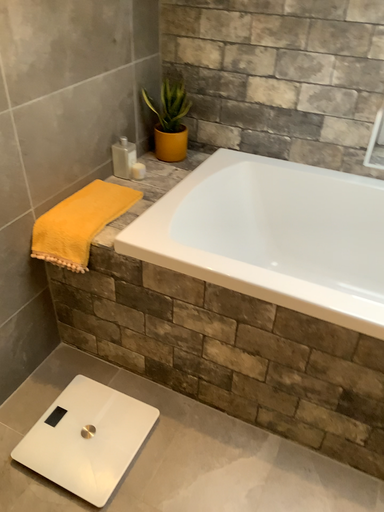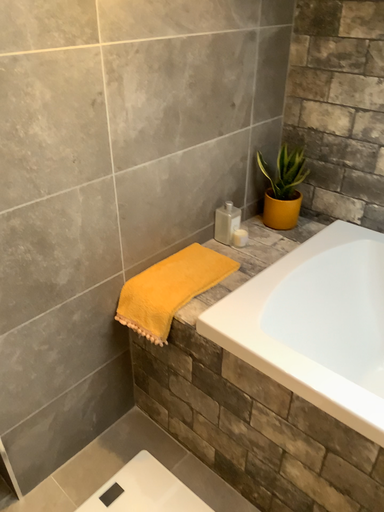
Question: Which way did the camera rotate in the video?

Choices:
 (A) rotated left
 (B) rotated right

Answer: (A)